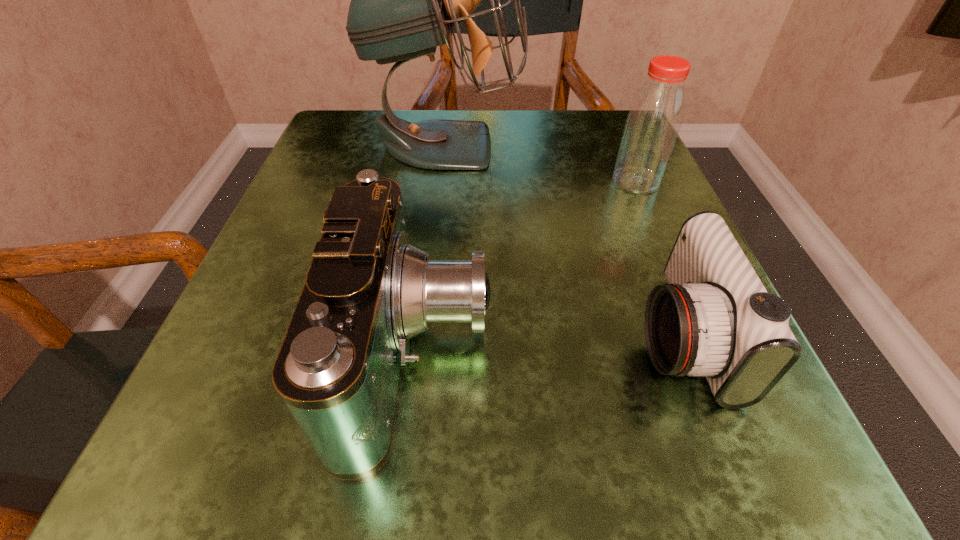
I want to click on free spot between the bottle and the second shortest object, so click(527, 267).

Locate an element on the screen. free space between the right camcorder and the bottle is located at coordinates (659, 259).

Locate an element on the screen. This screenshot has height=540, width=960. free spot between the shortest object and the tallest object is located at coordinates (563, 240).

Find the location of a particular element. This screenshot has height=540, width=960. free space between the left camcorder and the bottle is located at coordinates click(527, 267).

You are a GUI agent. You are given a task and a screenshot of the screen. Output one action in this format:
    pyautogui.click(x=<x>, y=<y>)
    Task: Click on the empty location between the second shortest object and the tallest object
    
    Given the screenshot: What is the action you would take?
    pyautogui.click(x=431, y=249)

I want to click on empty location between the bottle and the shortest object, so click(659, 259).

Locate an element on the screen. The height and width of the screenshot is (540, 960). free space between the tallest object and the bottle is located at coordinates (540, 163).

Identify the location of free space between the tallest object and the shortest object. The image size is (960, 540). (563, 240).

Identify which object is the second closest to the bottle. Please provide its 2D coordinates. Your answer should be formatted as a tuple, i.e. [(x, y)], where the tuple contains the x and y coordinates of a point satisfying the conditions above.

[(715, 318)]

In order to click on the second closest object to the bottle in this screenshot , I will do `click(715, 318)`.